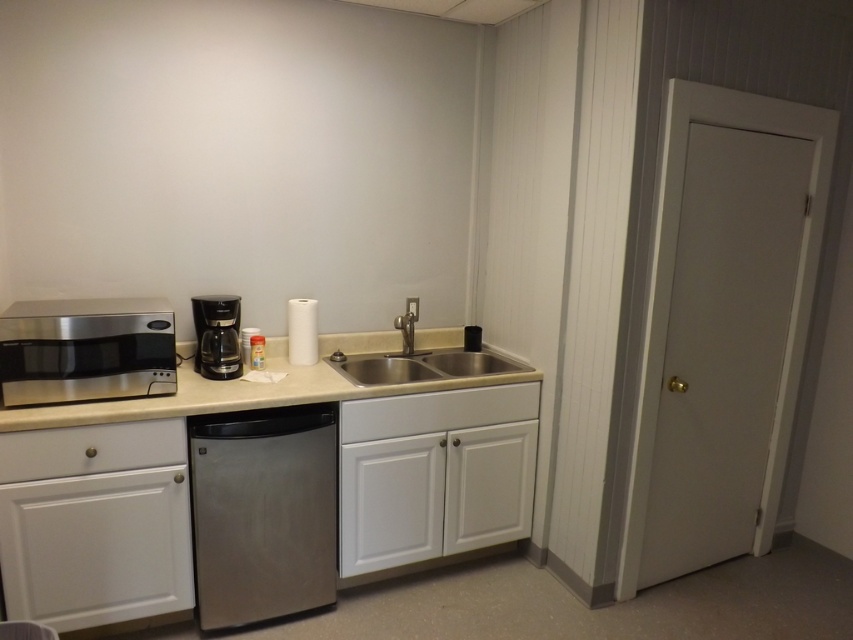
Does beige laminate counter top at center appear on the left side of white matte drawer at lower left?

Incorrect, beige laminate counter top at center is not on the left side of white matte drawer at lower left.

Is beige laminate counter top at center positioned at the back of white matte drawer at lower left?

No.

Does point (200, 408) lie in front of point (44, 456)?

No, (200, 408) is behind (44, 456).

The width and height of the screenshot is (853, 640). In order to click on beige laminate counter top at center in this screenshot , I will do `click(254, 387)`.

Find the location of `stainless steel microwave at left`. stainless steel microwave at left is located at coordinates (85, 349).

Where is `stainless steel microwave at left`? Image resolution: width=853 pixels, height=640 pixels. stainless steel microwave at left is located at coordinates (85, 349).

Consider the image. Can you confirm if beige laminate counter top at center is thinner than stainless steel sink at center?

No, beige laminate counter top at center is not thinner than stainless steel sink at center.

Which is more to the left, beige laminate counter top at center or stainless steel sink at center?

From the viewer's perspective, beige laminate counter top at center appears more on the left side.

Find the location of a particular element. Image resolution: width=853 pixels, height=640 pixels. beige laminate counter top at center is located at coordinates (254, 387).